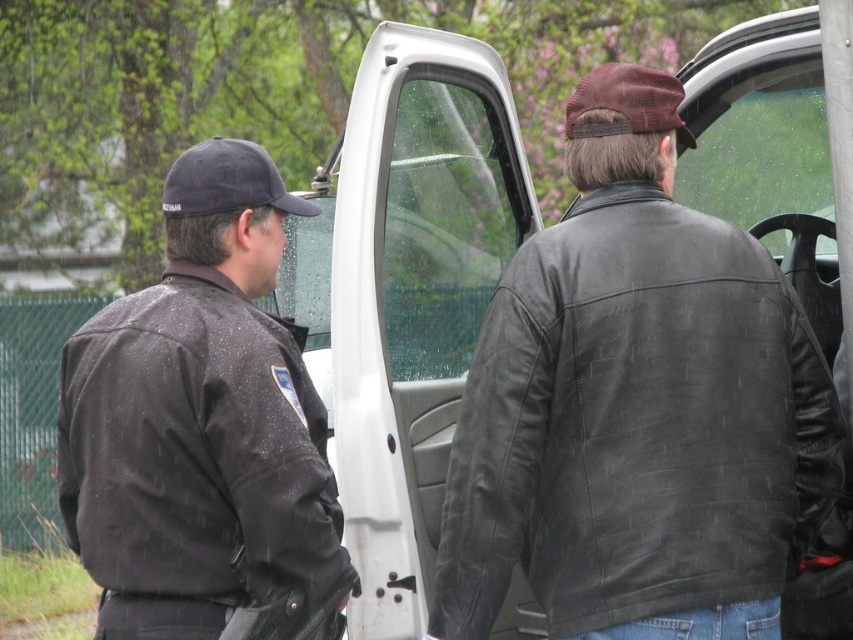
You are a tailor who needs to determine if the black leather jacket at left can fit into a storage box designed for items narrower than the black fabric baseball cap at left. Based on the scene, can the jacket fit?

The black leather jacket at left might be wider than the black fabric baseball cap at left, so it may not fit into the storage box designed for items narrower than the black fabric baseball cap at left.

You are a photographer trying to capture a clear photo of both the black leather jacket at left and the black fabric baseball cap at left. Since they are both black, you want to ensure that the jacket and cap are visible in the photo. Based on their positions, which one is closer to the camera?

The black leather jacket at left is in front of the black fabric baseball cap at left, so the jacket is closer to the camera and will appear more prominent in the photo.